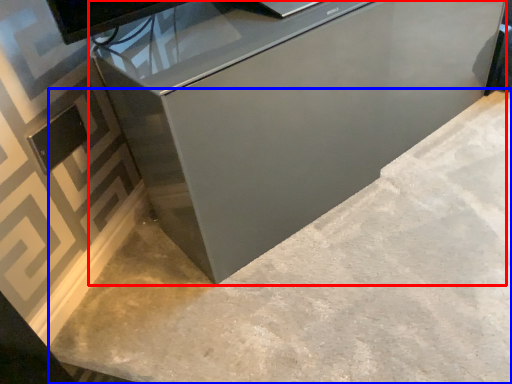
Question: Which point is further to the camera, furniture (highlighted by a red box) or concrete (highlighted by a blue box)?

Choices:
 (A) furniture
 (B) concrete

Answer: (A)